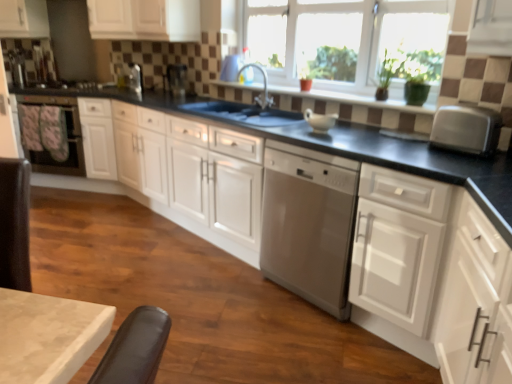
Question: Based on their positions, is white matte cabinet at upper left, which is the first cabinetry in left-to-right order, located to the left or right of matte black oven at left, placed as the 1th home appliance when sorted from back to front?

Choices:
 (A) left
 (B) right

Answer: (A)

Question: Looking at the image, does white matte cabinet at upper left, which is the first cabinetry in left-to-right order, seem bigger or smaller compared to matte black oven at left, arranged as the 1th home appliance when viewed from the left?

Choices:
 (A) small
 (B) big

Answer: (A)

Question: Which is farther from the white glossy cabinets at center, arranged as the 2th cabinetry when viewed from the right?

Choices:
 (A) white matte cabinet at upper left, placed as the 4th cabinetry when sorted from right to left
 (B) satin silver dishwasher at center, which is the 1th home appliance in right-to-left order
 (C) metallic silver toaster at upper center, which is counted as the 3th appliance, starting from the left
 (D) clear glass window at upper center
 (E) satin silver toaster at upper center, the second appliance when ordered from back to front

Answer: (A)

Question: Which object is the closest to the satin silver toaster at upper center, the second appliance when ordered from back to front?

Choices:
 (A) matte black oven at left, arranged as the 1th home appliance when viewed from the left
 (B) satin nickel faucet at center
 (C) brown tile window sill at center
 (D) black matte stove at left
 (E) silver metallic toaster at right

Answer: (D)